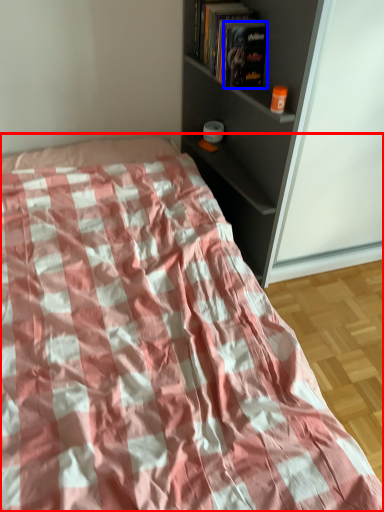
Question: Which object appears closest to the camera in this image, bed (highlighted by a red box) or paperback book (highlighted by a blue box)?

Choices:
 (A) bed
 (B) paperback book

Answer: (A)